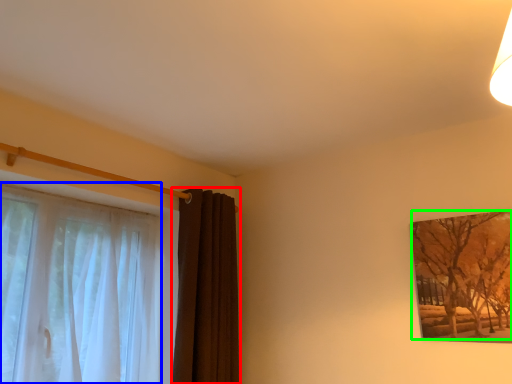
Question: Which is farther away from curtain (highlighted by a red box)? curtain (highlighted by a blue box) or tree (highlighted by a green box)?

Choices:
 (A) curtain
 (B) tree

Answer: (B)